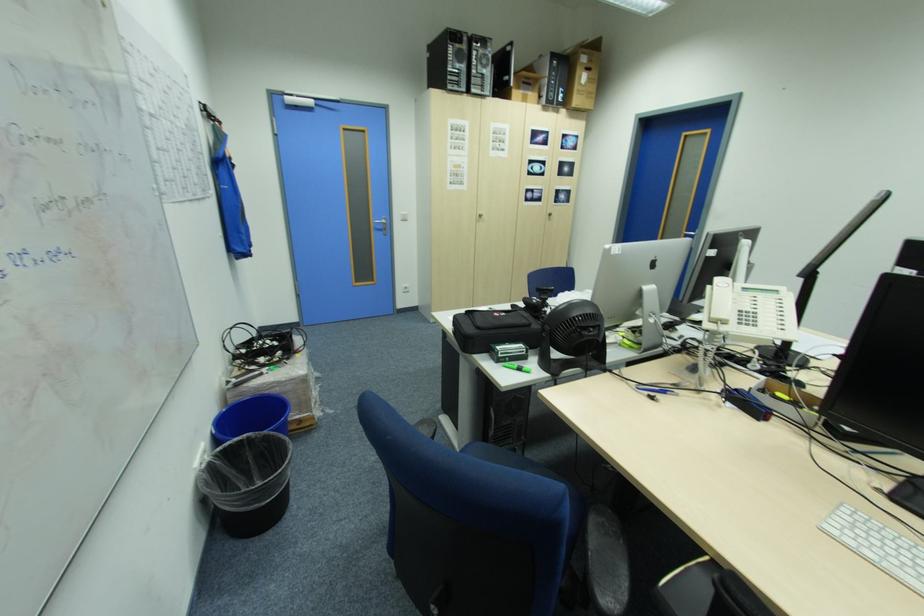
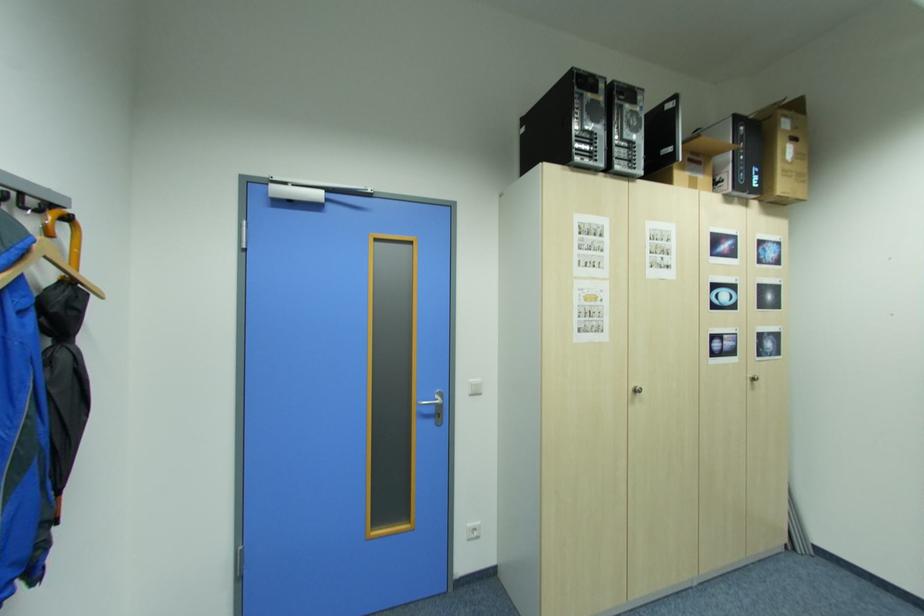
Locate, in the second image, the point that corresponds to (x=410, y=286) in the first image.

(476, 529)